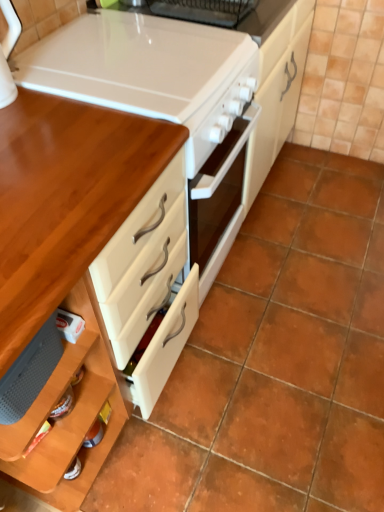
This screenshot has width=384, height=512. Identify the location of wooden table at left. [68, 190].

This screenshot has height=512, width=384. Describe the element at coordinates (68, 190) in the screenshot. I see `wooden table at left` at that location.

What do you see at coordinates (149, 72) in the screenshot?
I see `white glossy stove at upper center` at bounding box center [149, 72].

At what (x,y) coordinates should I click in order to perform the action: click on white glossy stove at upper center. Please return your answer as a coordinate pair (x, y). The width and height of the screenshot is (384, 512). Looking at the image, I should click on (149, 72).

This screenshot has width=384, height=512. I want to click on wooden table at left, so click(x=68, y=190).

Can you confirm if white glossy stove at upper center is positioned to the right of wooden table at left?

Yes, white glossy stove at upper center is to the right of wooden table at left.

Does white glossy stove at upper center come behind wooden table at left?

Yes, the depth of white glossy stove at upper center is greater than that of wooden table at left.

Between point (215, 81) and point (0, 249), which one is positioned in front?

Point (0, 249)

From the image's perspective, relative to wooden table at left, is white glossy stove at upper center above or below?

Clearly, from the image's perspective, white glossy stove at upper center is above wooden table at left.

From a real-world perspective, is white glossy stove at upper center on top of wooden table at left?

Yes, from a real-world perspective, white glossy stove at upper center is over wooden table at left

Is white glossy stove at upper center wider than wooden table at left?

No, white glossy stove at upper center is not wider than wooden table at left.

Is white glossy stove at upper center shorter than wooden table at left?

Yes.

Is white glossy stove at upper center bigger than wooden table at left?

Actually, white glossy stove at upper center might be smaller than wooden table at left.

Is wooden table at left located within white glossy stove at upper center?

That's incorrect, wooden table at left is not inside white glossy stove at upper center.

Is white glossy stove at upper center not near wooden table at left?

white glossy stove at upper center is near wooden table at left, not far away.

Is white glossy stove at upper center oriented away from wooden table at left?

white glossy stove at upper center does not have its back to wooden table at left.

The height and width of the screenshot is (512, 384). Identify the location of appliance above the wooden table at left (from a real-world perspective). (149, 72).

Which object is positioned more to the left, wooden table at left or white glossy stove at upper center?

wooden table at left is more to the left.

Is wooden table at left positioned in front of white glossy stove at upper center?

Yes, it is in front of white glossy stove at upper center.

Which is behind, point (102, 150) or point (148, 21)?

Positioned behind is point (148, 21).

From the image's perspective, is wooden table at left above or below white glossy stove at upper center?

wooden table at left is below white glossy stove at upper center.

From a real-world perspective, is wooden table at left positioned above or below white glossy stove at upper center?

wooden table at left is situated lower than white glossy stove at upper center in the real world.

Considering the sizes of objects wooden table at left and white glossy stove at upper center in the image provided, who is wider, wooden table at left or white glossy stove at upper center?

With larger width is wooden table at left.

Considering the relative sizes of wooden table at left and white glossy stove at upper center in the image provided, is wooden table at left taller than white glossy stove at upper center?

Yes.

Between wooden table at left and white glossy stove at upper center, which one has smaller size?

With smaller size is white glossy stove at upper center.

Can white glossy stove at upper center be found inside wooden table at left?

No, white glossy stove at upper center is not surrounded by wooden table at left.

Based on the photo, are wooden table at left and white glossy stove at upper center far apart?

No, wooden table at left is not far from white glossy stove at upper center.

Is wooden table at left oriented towards white glossy stove at upper center?

No.

How many degrees apart are the facing directions of wooden table at left and white glossy stove at upper center?

0.679 degrees separate the facing orientations of wooden table at left and white glossy stove at upper center.

The height and width of the screenshot is (512, 384). I want to click on table in front of the white glossy stove at upper center, so click(68, 190).

Identify the location of table that is in front of the white glossy stove at upper center. The height and width of the screenshot is (512, 384). (68, 190).

Where is `appliance above the wooden table at left (from a real-world perspective)`? appliance above the wooden table at left (from a real-world perspective) is located at coordinates (149, 72).